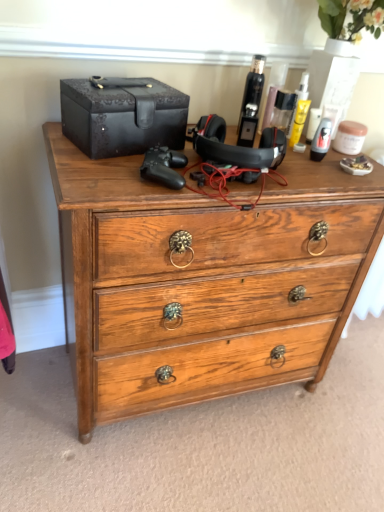
Image resolution: width=384 pixels, height=512 pixels. I want to click on free space in front of black leather box at upper left, so click(x=94, y=174).